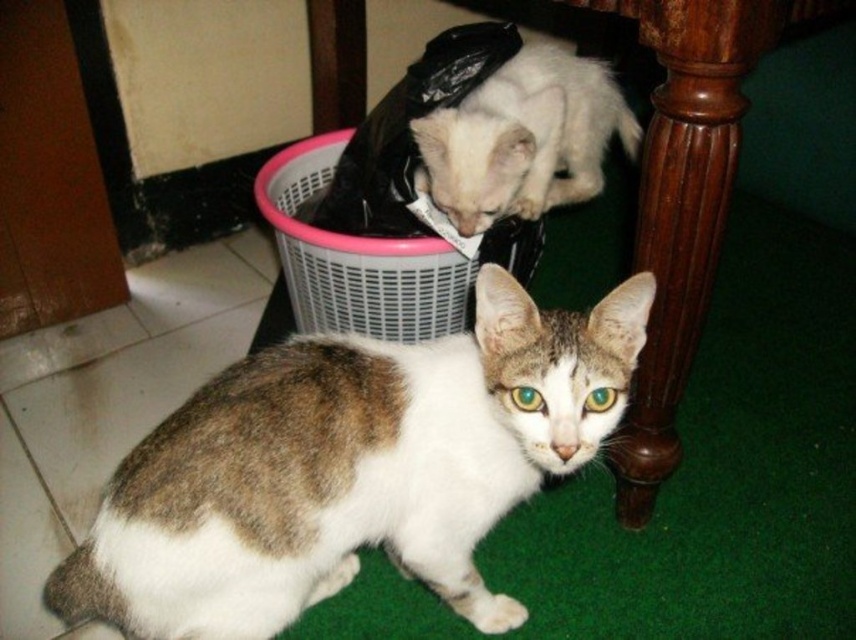
You are a photographer positioned at the origin point of the coordinate system. You want to take a photo of the brown and white fur cat at lower center. What are the coordinates where you should aim your camera?

The coordinates to aim your camera are at point (351,467) to capture the brown and white fur cat at lower center.

You are a photographer trying to capture a photo of both the brown and white fur cat at lower center and the pink plastic basket at upper center. Based on their positions, which cat should you focus on first to ensure both are in the frame?

You should focus on the brown and white fur cat at lower center first because it is positioned to the left of the pink plastic basket at upper center, so adjusting the frame to include the left side ensures both are captured.